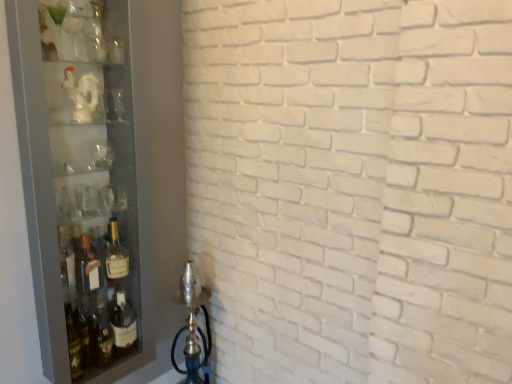
Question: Considering the positions of point (117, 18) and point (83, 89), is point (117, 18) closer or farther from the camera than point (83, 89)?

Choices:
 (A) closer
 (B) farther

Answer: (B)

Question: In the image, is transparent glass cabinet at left on the left side or the right side of white glossy statue at upper left?

Choices:
 (A) right
 (B) left

Answer: (A)

Question: Which is farther from the transparent glass cabinet at left?

Choices:
 (A) white glossy statue at upper left
 (B) matte glass bottle at left

Answer: (B)

Question: Based on their relative distances, which object is farther from the transparent glass cabinet at left?

Choices:
 (A) matte glass bottle at left
 (B) white glossy statue at upper left

Answer: (A)